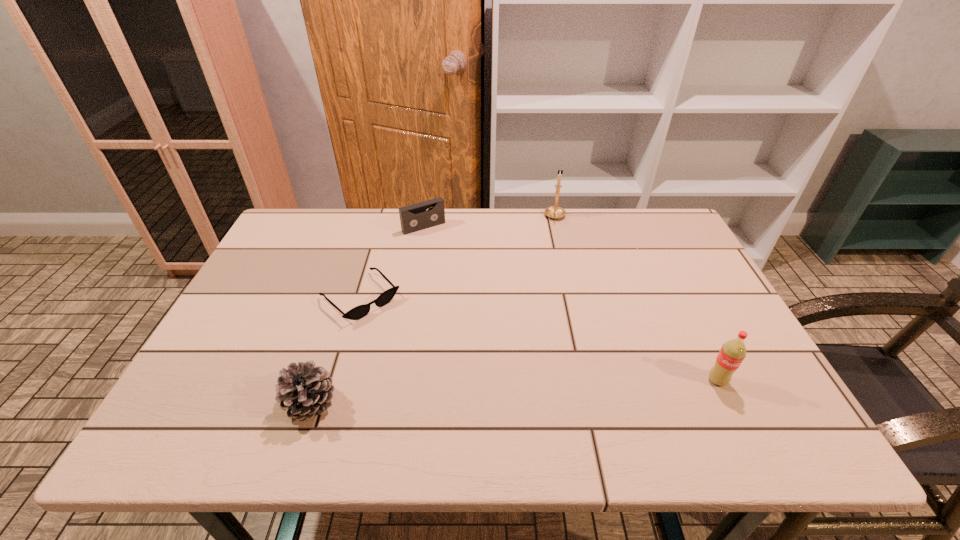
I want to click on vacant spot on the desktop that is between the third shortest object and the soda and is positioned on the handle side of the candle holder, so 554,390.

Find the location of a particular element. The height and width of the screenshot is (540, 960). free space on the desktop that is between the pinecone and the rightmost object and is positioned on the front-facing side of the third farthest object is located at coordinates (460, 395).

The image size is (960, 540). Find the location of `free space on the desktop that is between the third shortest object and the rightmost object and is positioned on the front-facing side of the second shortest object`. free space on the desktop that is between the third shortest object and the rightmost object and is positioned on the front-facing side of the second shortest object is located at coordinates (548, 390).